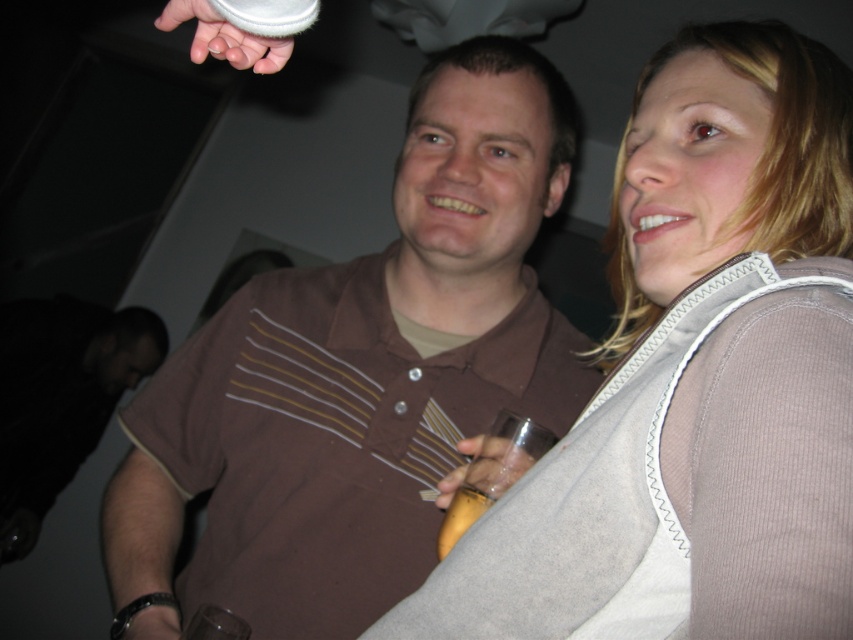
You are at a party and want to grab the translucent glass at right without touching the brown striped shirt at center. Is it possible based on their positions?

The brown striped shirt at center is above the translucent glass at right, so you can reach down to grab the translucent glass at right without touching the brown striped shirt at center.

You are a photographer at a party and want to take a photo of the suede vest at upper right. Where should you point your camera to capture it?

You should point your camera to the upper right area at point coordinates of (695, 378) to capture the suede vest at upper right.

You are organizing a costume party and need to decide which item to place on a display stand that can only hold items wider than 10 inches. You have the suede vest at upper right and the yellow plastic cup at center. Based on their sizes, which item should you choose?

The suede vest at upper right should be chosen because its width is larger than the yellow plastic cup at center, making it suitable for the display stand that requires items wider than 10 inches.